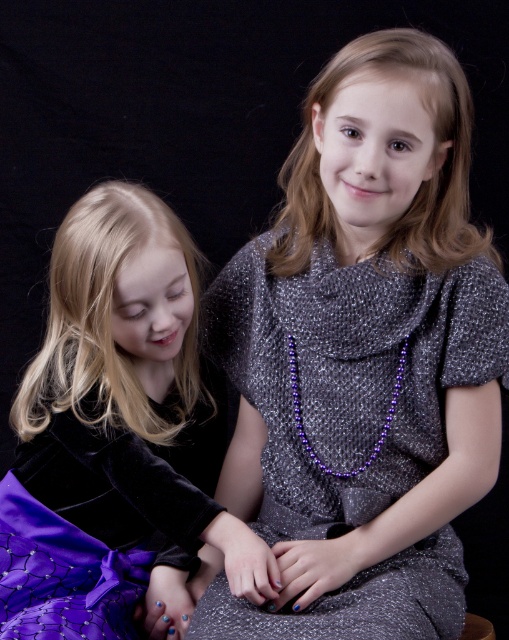
You are a photographer setting up for a photoshoot. You need to position a light source so that it illuminates the sparkly silver dress at center without casting a shadow on the purple velvet skirt at lower left. Based on their positions, can you achieve this?

Yes, since the sparkly silver dress at center is in front of the purple velvet skirt at lower left, positioning the light source behind the dress will illuminate it while preventing shadows from falling on the skirt.

You are a photographer setting up a shoot with two outfits displayed on a mannequin. The outfits are the sparkly silver dress at center and the purple velvet skirt at lower left. If you want to place a small accessory between them, how much space do you need to leave between the two outfits to ensure the accessory fits?

The sparkly silver dress at center and purple velvet skirt at lower left are 8.21 inches apart, so you need to leave at least 8.21 inches of space between them to fit the accessory.